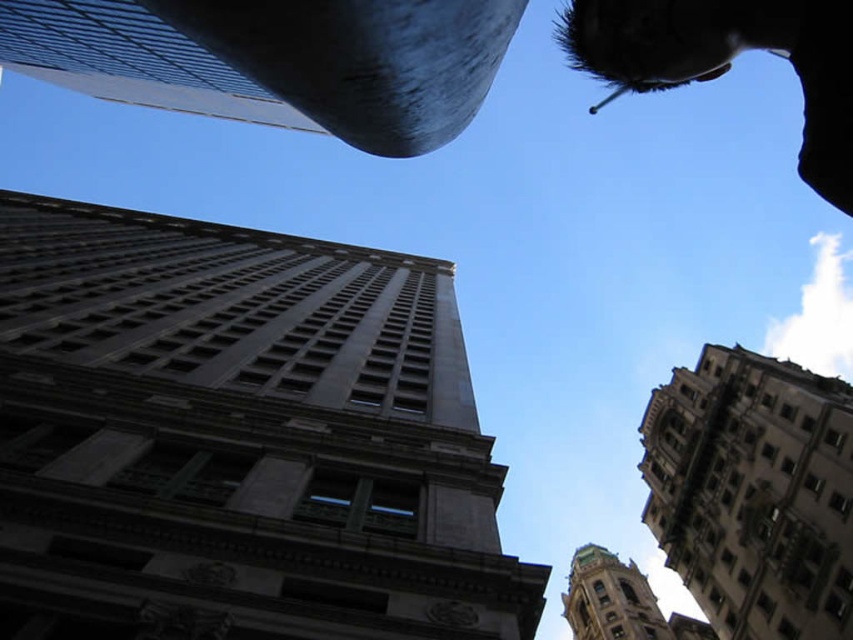
You are a photographer standing in the middle of the city square. You notice two objects at the upper right corner of your viewfinder. The first is the brown stone tower at upper right, and the second is the silvery hair at upper right. Which one appears lower in your view?

The brown stone tower at upper right appears lower because it is positioned below the silvery hair at upper right.

You are standing in the middle of the city square and see the gray stone tower at center and the green copper tower at lower right. Which tower is positioned to the left when facing the direction of the image?

The gray stone tower at center is positioned to the left of the green copper tower at lower right in the image.